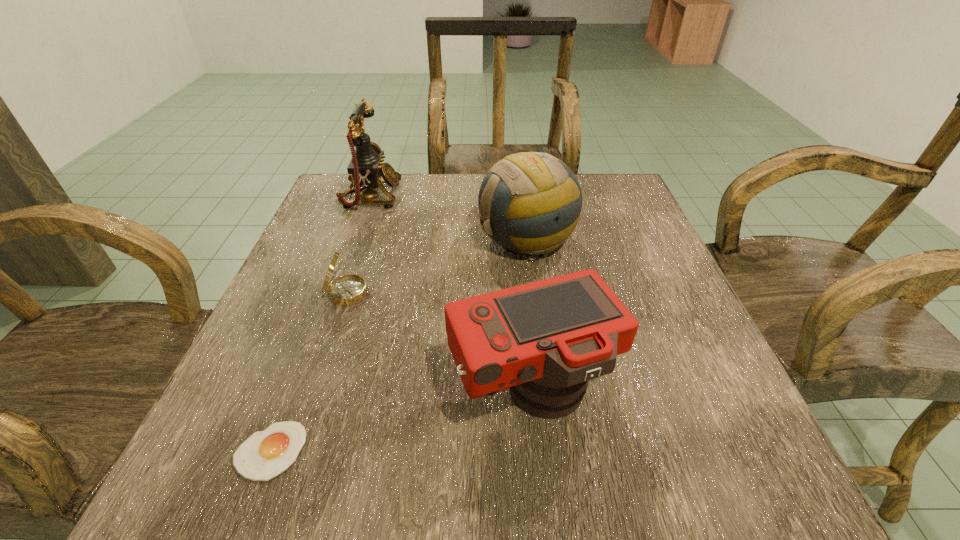
Locate an element on the screen. This screenshot has width=960, height=540. blank space located 0.090m on the right of the egg yolk is located at coordinates (372, 450).

Locate an element on the screen. The image size is (960, 540). telephone located at the far edge is located at coordinates (366, 167).

This screenshot has width=960, height=540. I want to click on volleyball at the far edge, so click(x=530, y=203).

Locate an element on the screen. The height and width of the screenshot is (540, 960). camera that is at the near edge is located at coordinates (545, 340).

The height and width of the screenshot is (540, 960). I want to click on egg yolk situated at the near edge, so click(x=265, y=454).

Image resolution: width=960 pixels, height=540 pixels. In order to click on telephone that is at the left edge in this screenshot , I will do `click(366, 167)`.

At what (x,y) coordinates should I click in order to perform the action: click on compass that is at the left edge. Please return your answer as a coordinate pair (x, y). Looking at the image, I should click on (349, 289).

Find the location of `egg yolk located in the left edge section of the desktop`. egg yolk located in the left edge section of the desktop is located at coordinates (265, 454).

Image resolution: width=960 pixels, height=540 pixels. Find the location of `object present at the far left corner`. object present at the far left corner is located at coordinates (366, 167).

This screenshot has width=960, height=540. Identify the location of object positioned at the near left corner. (265, 454).